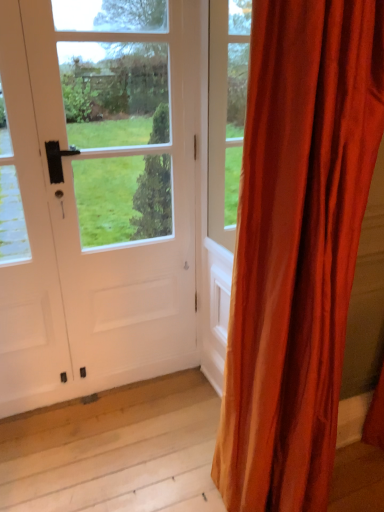
Question: Is satin orange curtain at right smaller than white matte door at center?

Choices:
 (A) no
 (B) yes

Answer: (A)

Question: Is satin orange curtain at right next to white matte door at center?

Choices:
 (A) yes
 (B) no

Answer: (B)

Question: Does satin orange curtain at right come behind white matte door at center?

Choices:
 (A) yes
 (B) no

Answer: (B)

Question: Would you consider satin orange curtain at right to be distant from white matte door at center?

Choices:
 (A) no
 (B) yes

Answer: (A)

Question: Is satin orange curtain at right positioned before white matte door at center?

Choices:
 (A) yes
 (B) no

Answer: (A)

Question: Is satin orange curtain at right shorter than white matte door at center?

Choices:
 (A) yes
 (B) no

Answer: (B)

Question: Does white matte door at center appear on the left side of satin orange curtain at right?

Choices:
 (A) yes
 (B) no

Answer: (A)

Question: Considering the relative sizes of white matte door at center and satin orange curtain at right in the image provided, is white matte door at center thinner than satin orange curtain at right?

Choices:
 (A) yes
 (B) no

Answer: (A)

Question: Is white matte door at center completely or partially outside of satin orange curtain at right?

Choices:
 (A) yes
 (B) no

Answer: (A)

Question: From the image's perspective, does white matte door at center appear higher than satin orange curtain at right?

Choices:
 (A) no
 (B) yes

Answer: (B)

Question: From the image's perspective, is white matte door at center beneath satin orange curtain at right?

Choices:
 (A) no
 (B) yes

Answer: (A)

Question: Is the depth of white matte door at center less than that of satin orange curtain at right?

Choices:
 (A) no
 (B) yes

Answer: (A)

Question: From the image's perspective, is satin orange curtain at right above or below white matte door at center?

Choices:
 (A) above
 (B) below

Answer: (B)